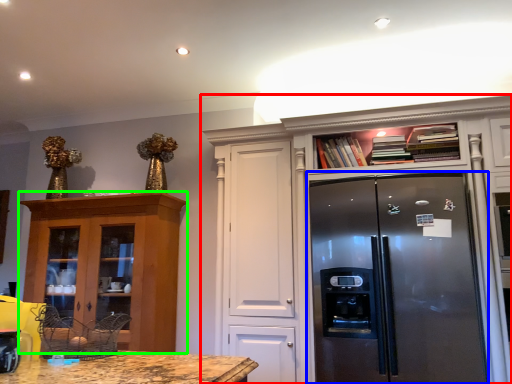
Question: Which object is the closest to the cabinetry (highlighted by a red box)? Choose among these: refrigerator (highlighted by a blue box) or cabinetry (highlighted by a green box).

Choices:
 (A) refrigerator
 (B) cabinetry

Answer: (A)